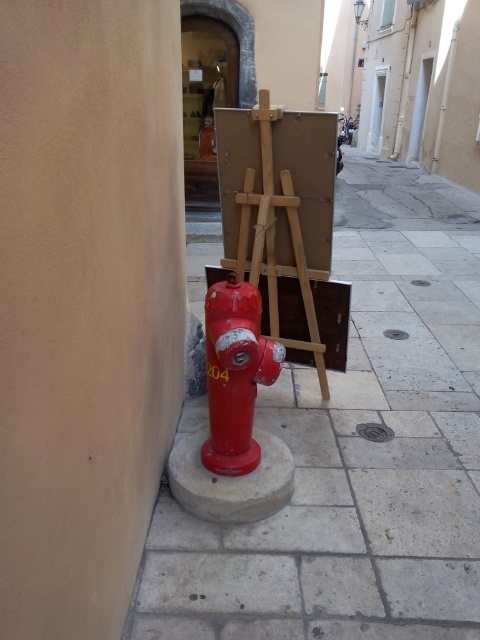
You are standing at the red fire hydrant with the number 204 marked on its side. You notice two points on the ground in front of you. The first point is at coordinates point (x=133, y=605) and the second point is at coordinates point (x=210, y=124). Which point is closer to you?

Point (x=133, y=605) is in front of point (x=210, y=124), so the first point is closer to you.